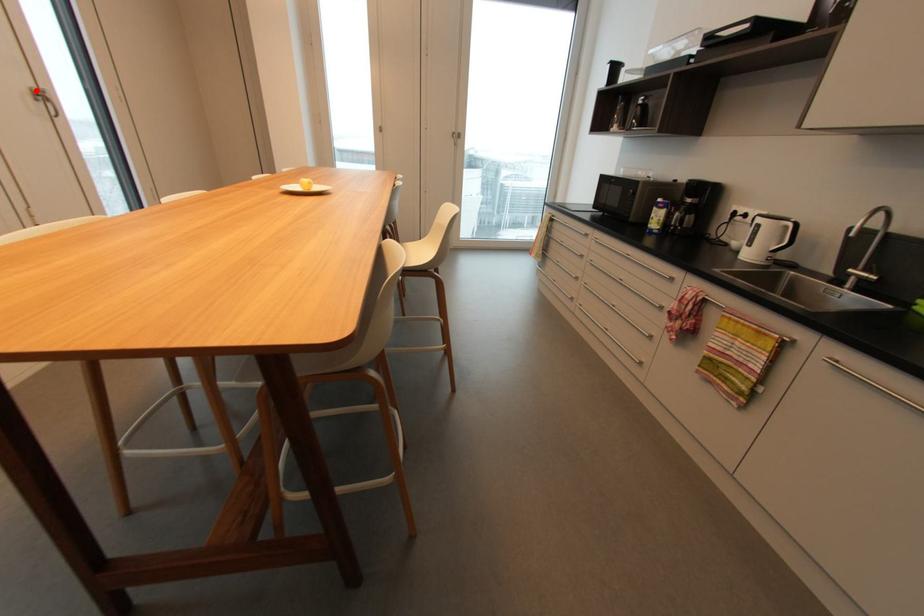
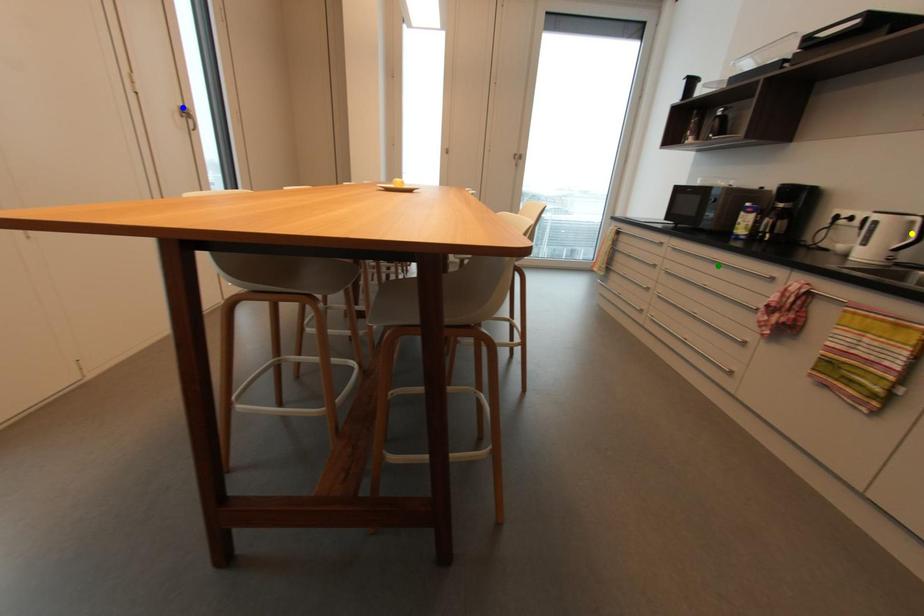
Question: I am providing you with two images of the same scene from different viewpoints. A red point is marked on the first image. You are given multiple points on the second image. Which spot in image 2 lines up with the point in image 1?

Choices:
 (A) blue point
 (B) green point
 (C) yellow point

Answer: (A)